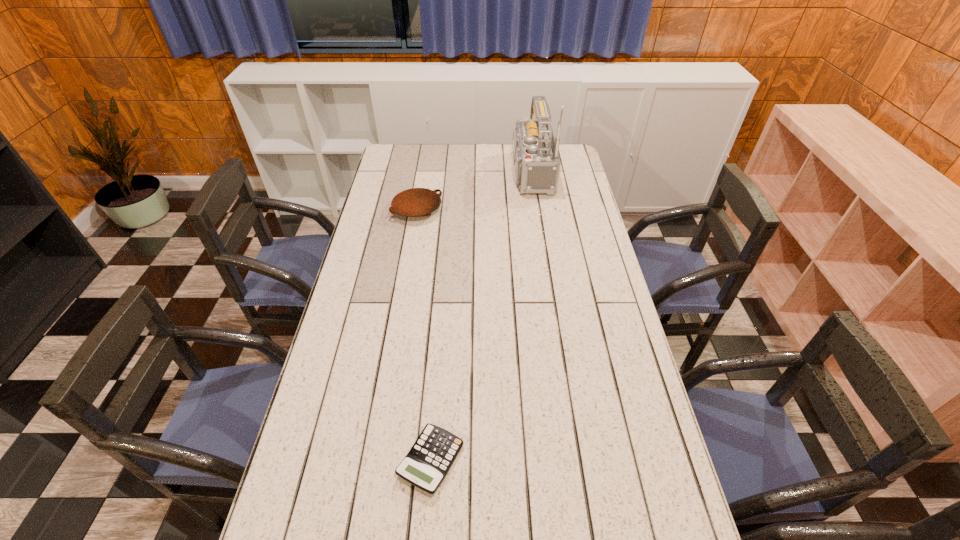
The height and width of the screenshot is (540, 960). In order to click on vacant point located between the plate and the rightmost object in this screenshot , I will do `click(471, 191)`.

This screenshot has height=540, width=960. I want to click on object identified as the second closest to the radio receiver, so click(x=427, y=463).

Identify which object is the second nearest to the nearest object. Please provide its 2D coordinates. Your answer should be formatted as a tuple, i.e. [(x, y)], where the tuple contains the x and y coordinates of a point satisfying the conditions above.

[(537, 163)]

Find the location of a particular element. The image size is (960, 540). blank area in the image that satisfies the following two spatial constraints: 1. on the front-facing side of the rightmost object; 2. on the front side of the plate is located at coordinates (531, 210).